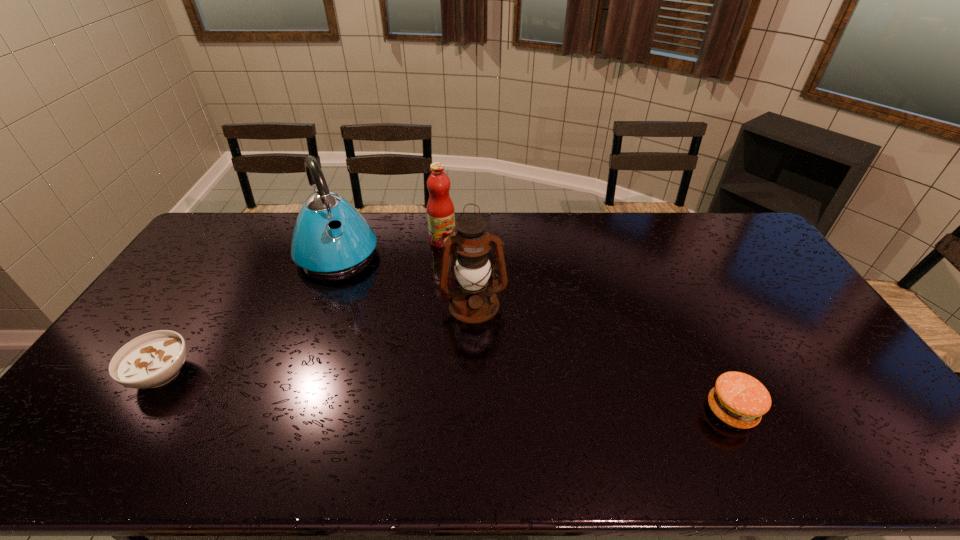
In order to click on free space located on the front label of the third shortest object in this screenshot , I will do `click(483, 319)`.

Image resolution: width=960 pixels, height=540 pixels. In order to click on blank area located 0.140m on the front label of the third shortest object in this screenshot , I will do tap(459, 272).

This screenshot has height=540, width=960. Find the location of `vacant space located 0.170m at the spout of the kettle`. vacant space located 0.170m at the spout of the kettle is located at coordinates (366, 310).

I want to click on vacant space situated 0.200m at the spout of the kettle, so click(369, 316).

Find the location of a particular element. The width and height of the screenshot is (960, 540). vacant space located 0.360m at the spout of the kettle is located at coordinates (387, 352).

Locate an element on the screen. vacant area situated on the side of the lantern, there is a wick adjustment knob is located at coordinates (486, 416).

At what (x,y) coordinates should I click in order to perform the action: click on blank area located on the side of the lantern, there is a wick adjustment knob. Please return your answer as a coordinate pair (x, y). Looking at the image, I should click on (482, 376).

Image resolution: width=960 pixels, height=540 pixels. In order to click on blank space located on the side of the lantern, there is a wick adjustment knob in this screenshot , I will do `click(483, 389)`.

Locate an element on the screen. This screenshot has width=960, height=540. fruit juice located at the far edge is located at coordinates (440, 209).

Locate an element on the screen. This screenshot has width=960, height=540. kettle positioned at the far edge is located at coordinates (348, 244).